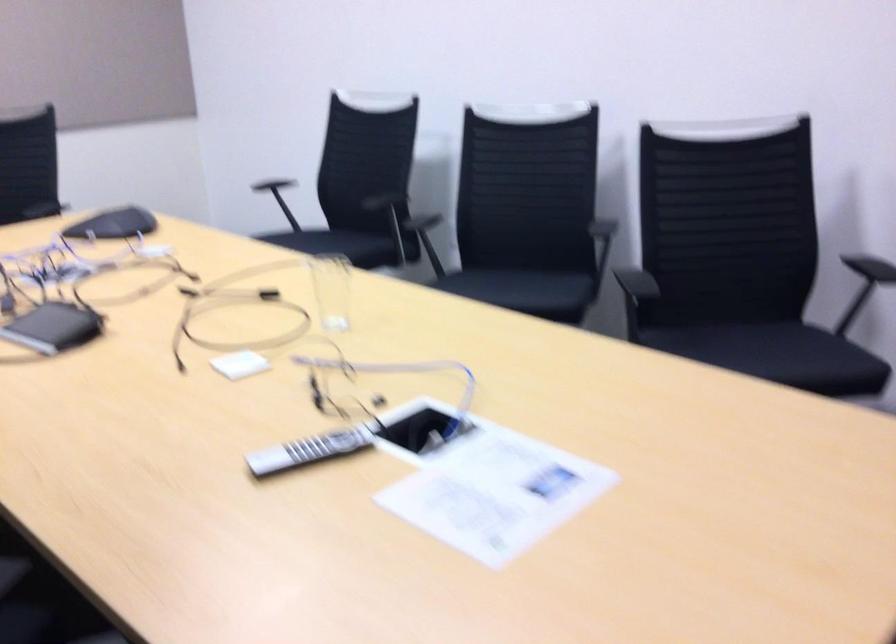
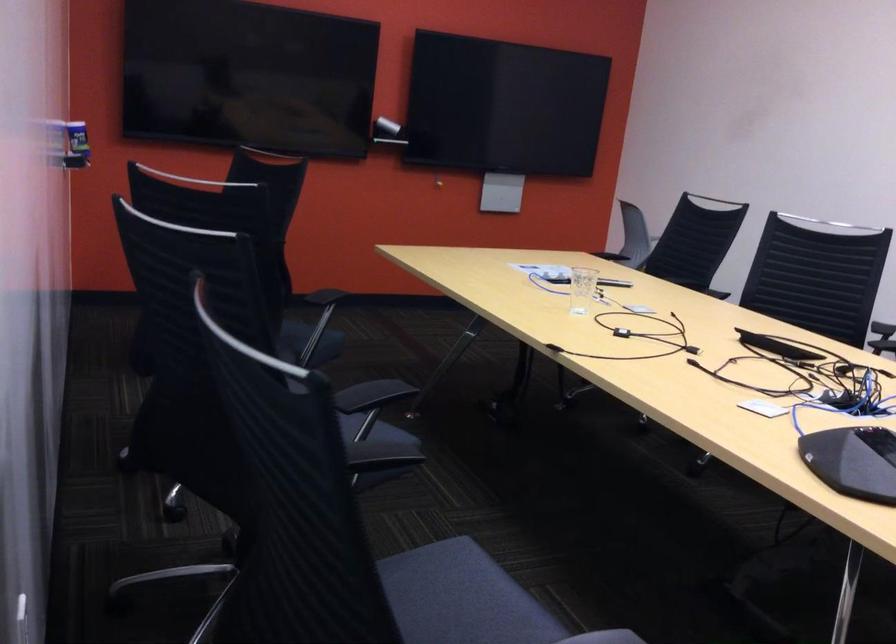
Locate, in the second image, the point that corresponds to the point at 649,344 in the first image.

(308, 342)